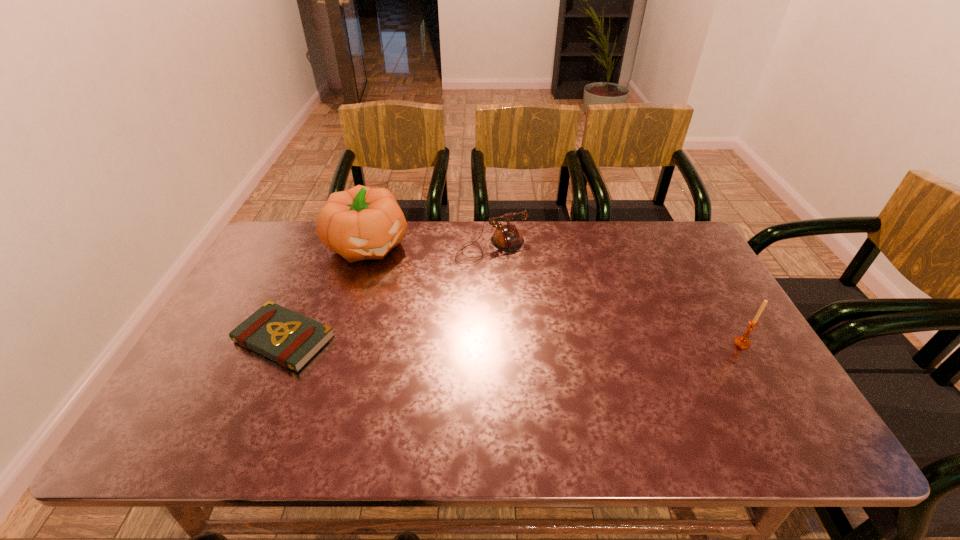
Where is `free spot on the desktop that is between the shortest object and the rightmost object and is positioned on the rotary dial of the telephone`? The width and height of the screenshot is (960, 540). free spot on the desktop that is between the shortest object and the rightmost object and is positioned on the rotary dial of the telephone is located at coordinates (555, 341).

At what (x,y) coordinates should I click in order to perform the action: click on free spot on the desktop that is between the shortest object and the second tallest object and is positioned on the carved face of the pumpkin. Please return your answer as a coordinate pair (x, y). The height and width of the screenshot is (540, 960). Looking at the image, I should click on (456, 341).